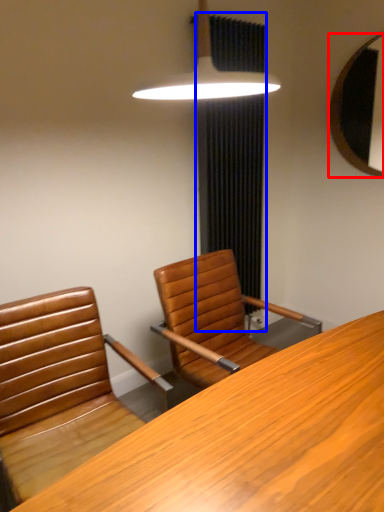
Question: Among these objects, which one is nearest to the camera, mirror (highlighted by a red box) or curtain (highlighted by a blue box)?

Choices:
 (A) mirror
 (B) curtain

Answer: (B)